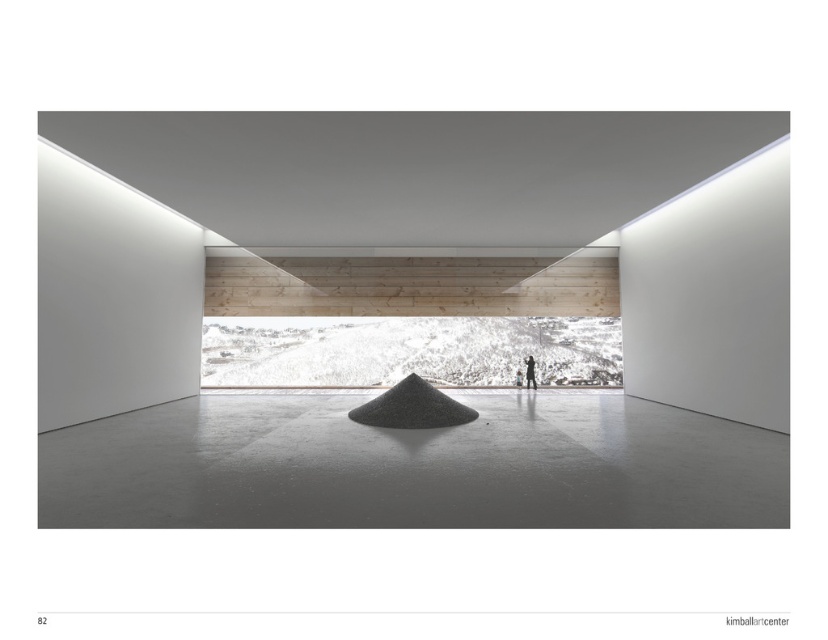
Question: Does gray polished concrete at center have a lesser width compared to black gravel mound at center?

Choices:
 (A) yes
 (B) no

Answer: (B)

Question: Which point is closer to the camera?

Choices:
 (A) (410, 412)
 (B) (526, 358)

Answer: (A)

Question: Does black gravel mound at center appear under matte black figure at center?

Choices:
 (A) no
 (B) yes

Answer: (B)

Question: Which object appears closest to the camera in this image?

Choices:
 (A) matte black figure at center
 (B) gray polished concrete at center
 (C) black gravel mound at center

Answer: (B)

Question: From the image, what is the correct spatial relationship of gray polished concrete at center in relation to black gravel mound at center?

Choices:
 (A) below
 (B) above

Answer: (A)

Question: Which point appears farthest from the camera in this image?

Choices:
 (A) (528, 385)
 (B) (551, 476)
 (C) (407, 413)

Answer: (A)